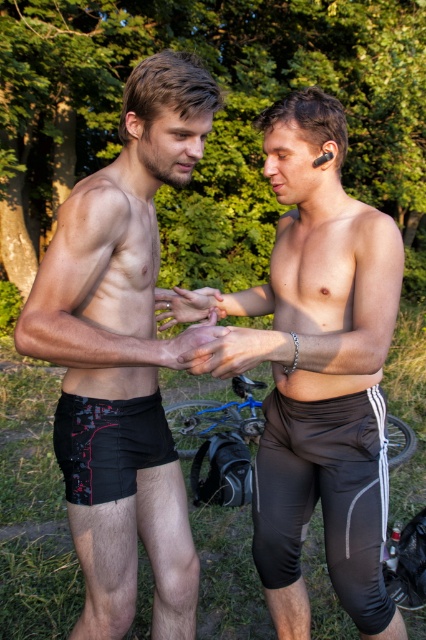
Based on the scene description, can you determine if the black matte shorts at left are placed on top of the blue metallic bicycle at center?

The black matte shorts at left is positioned over blue metallic bicycle at center, so yes, the black matte shorts at left are placed on top of the blue metallic bicycle at center.